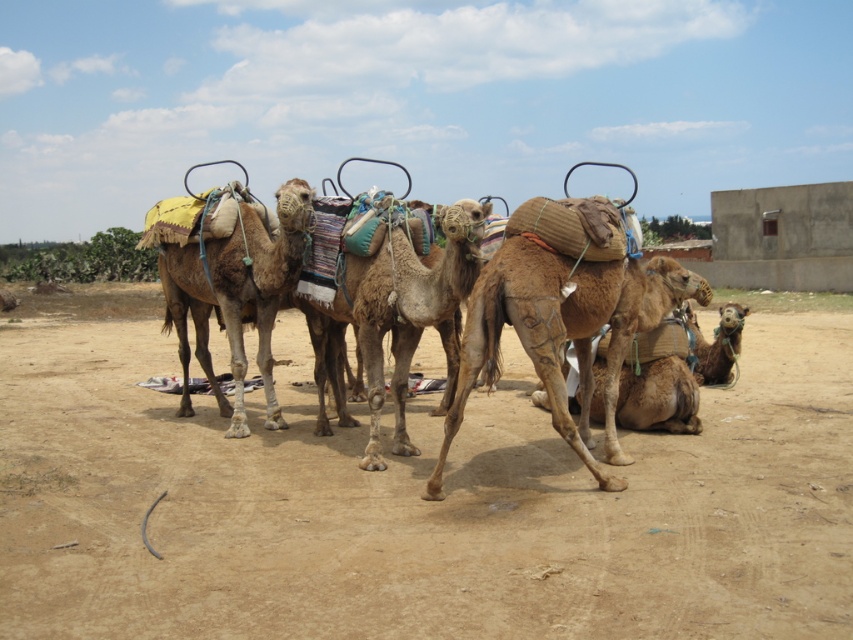
Does brown sandy dirt track at center have a larger size compared to brown textured camel at center?

Indeed, brown sandy dirt track at center has a larger size compared to brown textured camel at center.

Who is more forward, (477, 532) or (514, 285)?

Point (477, 532) is more forward.

Where is `brown sandy dirt track at center`? The image size is (853, 640). brown sandy dirt track at center is located at coordinates (416, 504).

Is brown textured camel at center smaller than brown rough camel at center?

No.

Does brown textured camel at center have a greater width compared to brown rough camel at center?

Yes.

Does point (368, 449) come in front of point (601, 292)?

No, (368, 449) is further to viewer.

The width and height of the screenshot is (853, 640). Find the location of `brown textured camel at center`. brown textured camel at center is located at coordinates (561, 332).

Which is in front, point (68, 337) or point (436, 468)?

Point (436, 468)

Identify the location of brown sandy dirt track at center. The height and width of the screenshot is (640, 853). (416, 504).